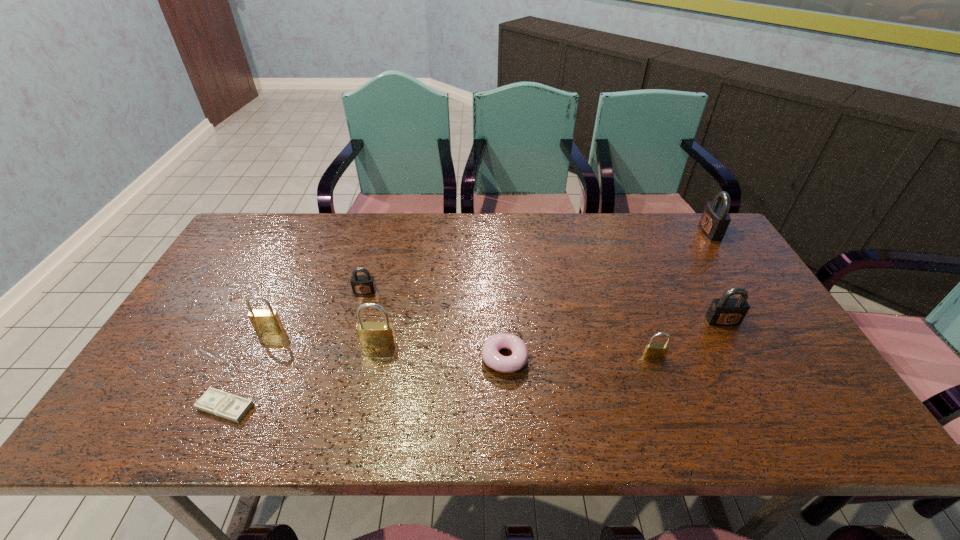
In order to click on free spot at the near edge of the desktop in this screenshot , I will do `click(742, 417)`.

Find the location of a particular element. The height and width of the screenshot is (540, 960). vacant region at the right edge of the desktop is located at coordinates (701, 258).

Identify the location of free spot at the far right corner of the desktop. (673, 232).

Find the location of a particular element. This screenshot has height=540, width=960. free space at the near right corner of the desktop is located at coordinates (831, 402).

Where is `free space between the second farthest gray padlock and the purple doughnut`? This screenshot has height=540, width=960. free space between the second farthest gray padlock and the purple doughnut is located at coordinates pos(435,325).

Locate an element on the screen. This screenshot has height=540, width=960. free space between the nearest object and the fifth object from left to right is located at coordinates (365, 382).

The width and height of the screenshot is (960, 540). Find the location of `empty space between the fifth object from left to right and the nearest gray padlock`. empty space between the fifth object from left to right and the nearest gray padlock is located at coordinates (613, 340).

The image size is (960, 540). What are the coordinates of `vacant area between the sixth object from left to right and the money` in the screenshot? It's located at (440, 382).

I want to click on free space between the nearest padlock and the money, so click(440, 382).

Identify the location of unoccupied position between the second biggest gray padlock and the leftmost gray padlock. (543, 306).